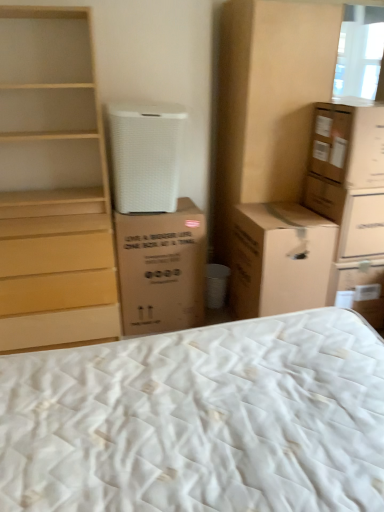
Question: In terms of size, does brown cardboard cabinet at upper right appear bigger or smaller than brown cardboard box at right, which is counted as the 1th cardboard box, starting from the right?

Choices:
 (A) big
 (B) small

Answer: (A)

Question: Is brown cardboard cabinet at upper right in front of or behind brown cardboard box at right, which is counted as the 1th cardboard box, starting from the right, in the image?

Choices:
 (A) behind
 (B) front

Answer: (B)

Question: Considering the real-world distances, which object is closest to the white quilted mattress at lower center?

Choices:
 (A) brown cardboard box at center, the 4th cardboard box from the right
 (B) brown cardboard box at upper right, marked as the third cardboard box in a right-to-left arrangement
 (C) brown cardboard box at right, which is counted as the 1th cardboard box, starting from the right
 (D) light wood chest of drawers at left
 (E) white matte air purifier at upper center

Answer: (B)

Question: Based on their relative distances, which object is farther from the brown cardboard box at center, the 4th cardboard box from the right?

Choices:
 (A) white matte air purifier at upper center
 (B) white quilted mattress at lower center
 (C) brown cardboard cabinet at upper right
 (D) brown cardboard box at upper right, the 3th cardboard box when ordered from left to right
 (E) brown cardboard box at upper right, the 2th cardboard box positioned from the left

Answer: (B)